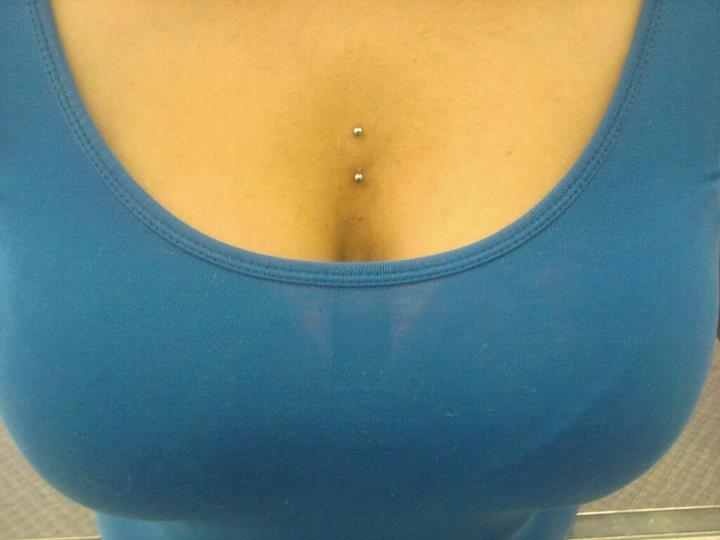
You are a GUI agent. You are given a task and a screenshot of the screen. Output one action in this format:
    pyautogui.click(x=<x>, y=<y>)
    Task: Click on the chest
    
    Given the screenshot: What is the action you would take?
    pyautogui.click(x=335, y=44)